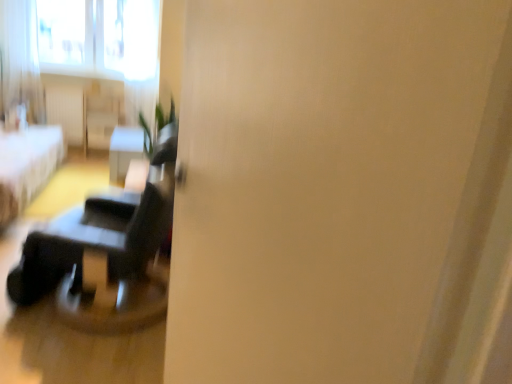
Question: From the image's perspective, is matte black table at center beneath white sheer curtain at upper left?

Choices:
 (A) no
 (B) yes

Answer: (B)

Question: Considering the relative sizes of matte black table at center and white sheer curtain at upper left in the image provided, is matte black table at center bigger than white sheer curtain at upper left?

Choices:
 (A) yes
 (B) no

Answer: (A)

Question: From the image's perspective, is matte black table at center on white sheer curtain at upper left?

Choices:
 (A) yes
 (B) no

Answer: (B)

Question: Is matte black table at center facing away from white sheer curtain at upper left?

Choices:
 (A) no
 (B) yes

Answer: (A)

Question: Does matte black table at center appear on the left side of white sheer curtain at upper left?

Choices:
 (A) yes
 (B) no

Answer: (B)

Question: Would you consider matte black table at center to be distant from white sheer curtain at upper left?

Choices:
 (A) yes
 (B) no

Answer: (A)

Question: Is white sheer curtain at upper left facing towards matte black table at center?

Choices:
 (A) yes
 (B) no

Answer: (B)

Question: Can you confirm if white sheer curtain at upper left is thinner than matte black table at center?

Choices:
 (A) no
 (B) yes

Answer: (B)

Question: Does white sheer curtain at upper left appear on the left side of matte black table at center?

Choices:
 (A) no
 (B) yes

Answer: (B)

Question: Is white sheer curtain at upper left turned away from matte black table at center?

Choices:
 (A) yes
 (B) no

Answer: (B)

Question: Is white sheer curtain at upper left positioned behind matte black table at center?

Choices:
 (A) no
 (B) yes

Answer: (B)

Question: Is white sheer curtain at upper left positioned in front of matte black table at center?

Choices:
 (A) yes
 (B) no

Answer: (B)

Question: Is white fabric bed at left behind white sheer curtain at upper left?

Choices:
 (A) yes
 (B) no

Answer: (B)